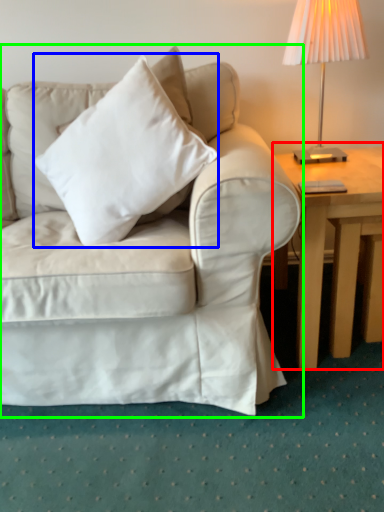
Question: Considering the real-world distances, which object is closest to table (highlighted by a red box)? pillow (highlighted by a blue box) or studio couch (highlighted by a green box).

Choices:
 (A) pillow
 (B) studio couch

Answer: (B)